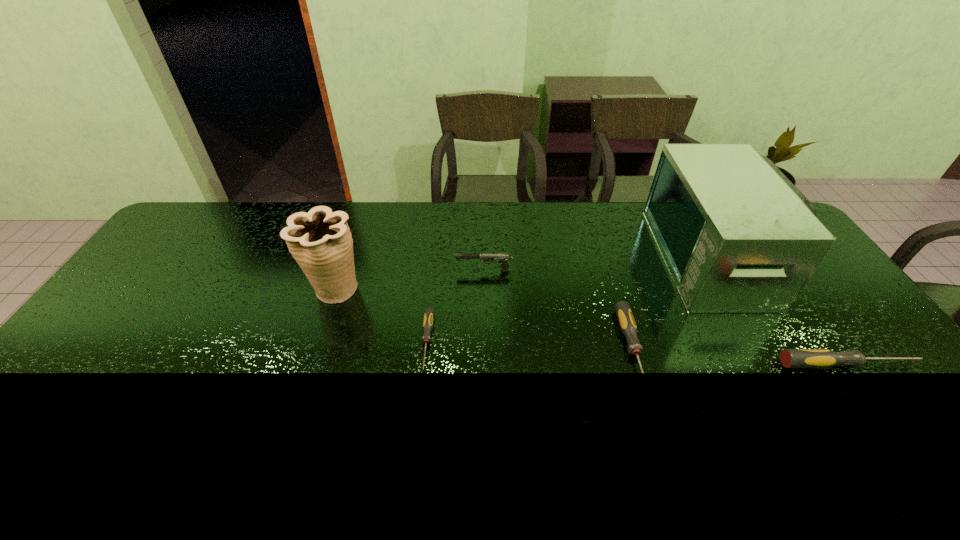
Where is `vacant space located 0.290m at the muzzle end of the gun`? The image size is (960, 540). vacant space located 0.290m at the muzzle end of the gun is located at coordinates click(365, 270).

At what (x,y) coordinates should I click in order to perform the action: click on vacant region located 0.220m at the muzzle end of the gun. Please return your answer as a coordinate pair (x, y). This screenshot has height=540, width=960. Looking at the image, I should click on (x=387, y=270).

At what (x,y) coordinates should I click in order to perform the action: click on free location located at the muzzle end of the gun. Please return your answer as a coordinate pair (x, y). This screenshot has height=540, width=960. Looking at the image, I should click on (362, 270).

Where is `vacant space situated 0.380m on the front-facing side of the microwave oven`? vacant space situated 0.380m on the front-facing side of the microwave oven is located at coordinates (547, 257).

At what (x,y) coordinates should I click in order to perform the action: click on free spot located 0.190m on the front-facing side of the microwave oven. Please return your answer as a coordinate pair (x, y). Looking at the image, I should click on (605, 257).

What are the coordinates of `free space located 0.200m on the front-facing side of the microwave oven` in the screenshot? It's located at (602, 257).

I want to click on free location located 0.170m on the back of the leftmost object, so click(x=353, y=235).

You are a GUI agent. You are given a task and a screenshot of the screen. Output one action in this format:
    pyautogui.click(x=<x>, y=<y>)
    Task: Click on the object present at the far edge
    
    Given the screenshot: What is the action you would take?
    pyautogui.click(x=737, y=236)

Locate an element on the screen. object located at the near edge is located at coordinates (625, 317).

The image size is (960, 540). Identify the location of screwdriver present at the right edge. (790, 358).